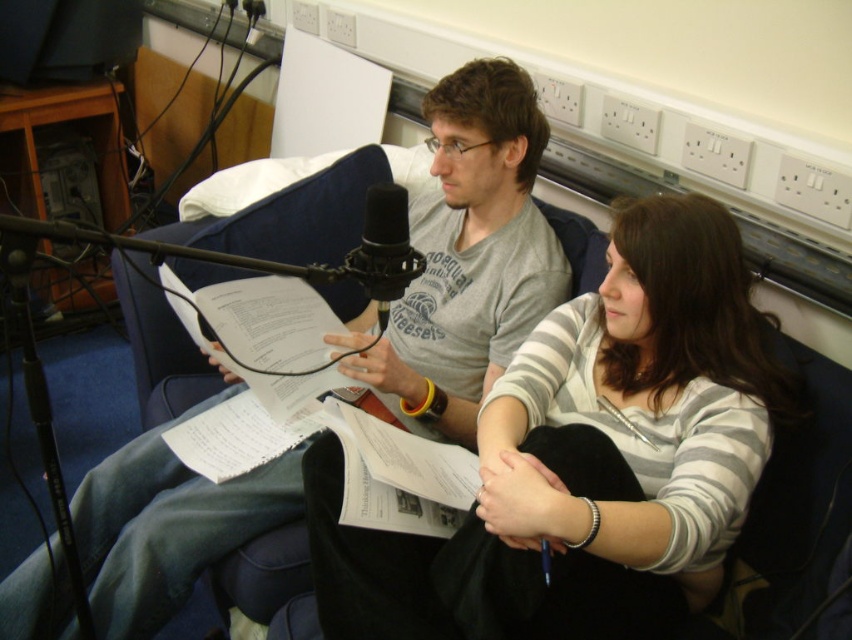
Question: Is striped cotton sweater at center to the right of gray cotton t-shirt at center from the viewer's perspective?

Choices:
 (A) no
 (B) yes

Answer: (B)

Question: Which object is the farthest from the black foam microphone at center?

Choices:
 (A) gray cotton t-shirt at center
 (B) striped cotton sweater at center

Answer: (A)

Question: Which point is closer to the camera?

Choices:
 (A) (400, 195)
 (B) (603, 472)

Answer: (A)

Question: Which object is the farthest from the gray cotton t-shirt at center?

Choices:
 (A) striped cotton sweater at center
 (B) black foam microphone at center

Answer: (B)

Question: Is gray cotton t-shirt at center in front of black foam microphone at center?

Choices:
 (A) yes
 (B) no

Answer: (B)

Question: From the image, what is the correct spatial relationship of striped cotton sweater at center in relation to gray cotton t-shirt at center?

Choices:
 (A) right
 (B) left

Answer: (A)